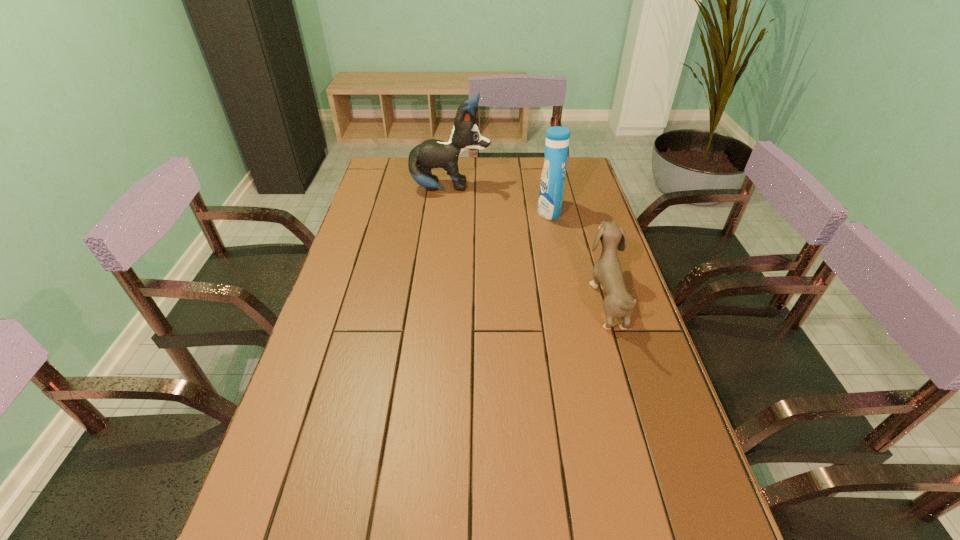
Image resolution: width=960 pixels, height=540 pixels. In order to click on the leftmost object in this screenshot , I will do `click(432, 153)`.

The image size is (960, 540). Find the location of `the taller puppy`. the taller puppy is located at coordinates (432, 153).

You are a GUI agent. You are given a task and a screenshot of the screen. Output one action in this format:
    pyautogui.click(x=<x>, y=<y>)
    Task: Click on the second object from right to left
    
    Given the screenshot: What is the action you would take?
    (552, 183)

This screenshot has height=540, width=960. Identify the location of detergent. (552, 183).

I want to click on the nearest object, so (x=607, y=271).

At what (x,y) coordinates should I click in order to perform the action: click on the shortest object. Please return your answer as a coordinate pair (x, y). Looking at the image, I should click on (607, 271).

Find the location of a particular element. Image resolution: width=960 pixels, height=540 pixels. free location located 0.250m on the front-facing side of the farther puppy is located at coordinates (557, 188).

The width and height of the screenshot is (960, 540). I want to click on free spot located 0.240m on the front-facing side of the second farthest object, so click(469, 211).

I want to click on free region located on the front-facing side of the second farthest object, so click(490, 211).

Where is `blank space located 0.360m on the front-facing side of the second farthest object`? blank space located 0.360m on the front-facing side of the second farthest object is located at coordinates (435, 211).